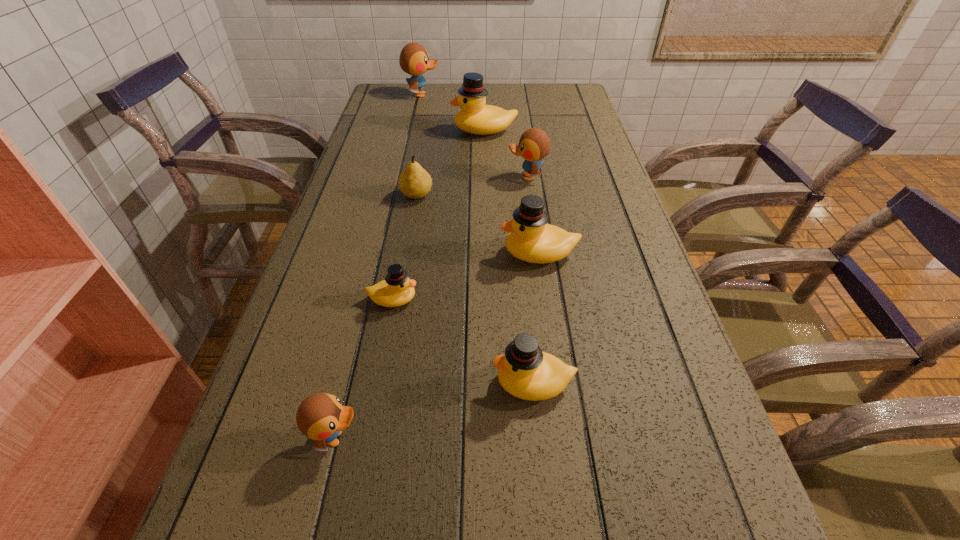
Identify the location of the third biggest yellow duck. The height and width of the screenshot is (540, 960). (525, 372).

Image resolution: width=960 pixels, height=540 pixels. I want to click on the nearest object, so click(321, 417).

You are a GUI agent. You are given a task and a screenshot of the screen. Output one action in this format:
    pyautogui.click(x=<x>, y=<y>)
    Task: Click on the nearest blue duck
    The image size is (960, 540).
    Given the screenshot: What is the action you would take?
    pyautogui.click(x=321, y=417)

At what (x,y) coordinates should I click in order to perform the action: click on the shortest duck. Please return your answer as a coordinate pair (x, y). This screenshot has width=960, height=540. Looking at the image, I should click on (397, 289).

Find the location of a particular element. The image size is (960, 540). the third nearest object is located at coordinates (397, 289).

Identify the location of vacant space located on the front-facing side of the biggest blue duck. (x=454, y=94).

Locate an element on the screen. The image size is (960, 540). blank area located on the front-facing side of the farthest yellow duck is located at coordinates (408, 131).

Where is `vacant space located 0.140m on the front-facing side of the farthest yellow duck`? This screenshot has width=960, height=540. vacant space located 0.140m on the front-facing side of the farthest yellow duck is located at coordinates coord(408,131).

Locate an element on the screen. The image size is (960, 540). vacant region located 0.290m on the front-facing side of the farthest yellow duck is located at coordinates (363, 131).

This screenshot has height=540, width=960. What are the coordinates of `vacant space located 0.280m on the front-facing side of the second biggest yellow duck` in the screenshot? It's located at (379, 253).